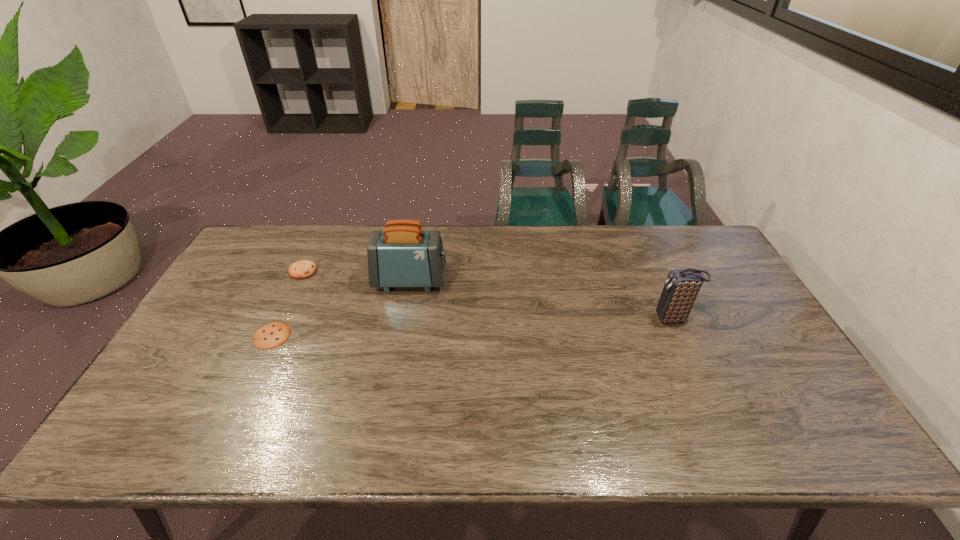
You are a GUI agent. You are given a task and a screenshot of the screen. Output one action in this format:
    pyautogui.click(x=<x>, y=<y>)
    Task: Click on the toaster
    The width and height of the screenshot is (960, 540).
    Given the screenshot: What is the action you would take?
    pyautogui.click(x=402, y=255)

This screenshot has height=540, width=960. I want to click on clutch bag, so click(x=681, y=288).

Locate an element on the screen. the third shortest object is located at coordinates (681, 288).

You are a GUI agent. You are given a task and a screenshot of the screen. Output one action in this format:
    pyautogui.click(x=<x>, y=<y>)
    Task: Click on the taller cookie
    This screenshot has width=960, height=540.
    Given the screenshot: What is the action you would take?
    pyautogui.click(x=301, y=269)

Where is `the farther cookie`? The width and height of the screenshot is (960, 540). the farther cookie is located at coordinates (301, 269).

Locate an element on the screen. This screenshot has height=540, width=960. the shorter cookie is located at coordinates (269, 336).

Find the location of a particular element. The image size is (960, 540). the nearer cookie is located at coordinates (269, 336).

Image resolution: width=960 pixels, height=540 pixels. In order to click on free region located 0.130m on the front-facing side of the toaster in this screenshot , I will do `click(487, 280)`.

Identify the location of vacant space situated with the zip open on the clutch bag. (553, 319).

I want to click on vacant region located 0.340m with the zip open on the clutch bag, so click(535, 319).